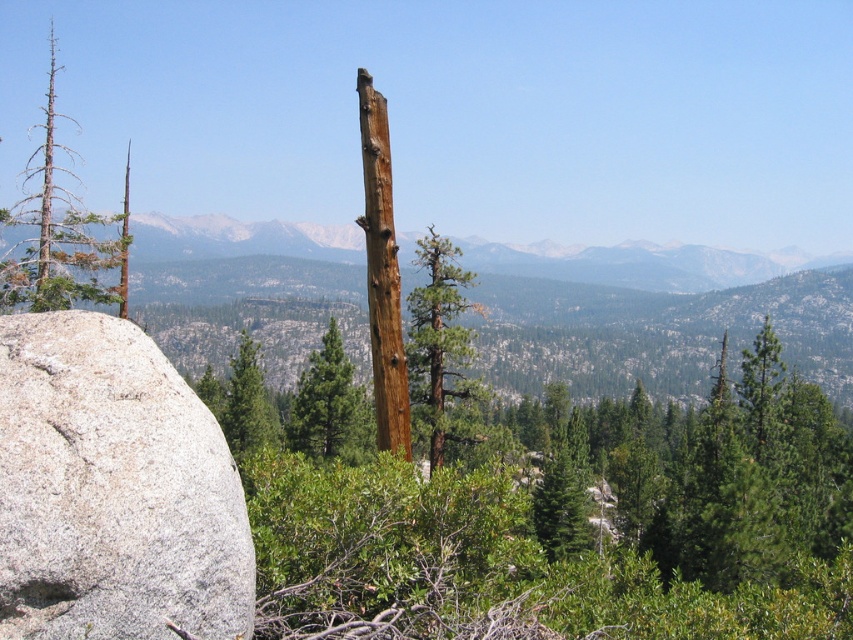
You are a hiker planning to take a photo of the gray rough boulder at left from the center of the image. Based on its coordinates, in which direction should you move to get a better view?

The gray rough boulder at left is located at point (112, 490), so you should move to the right and slightly downward to center it in your viewfinder.

From the picture: You are a hiker who wants to take a photo of the gray rough boulder at left and the green rough bark tree at center. Since you have a camera with a fixed focal length, you need to know which object is taller to adjust your settings. Can you tell me which one is taller?

The green rough bark tree at center is taller than the gray rough boulder at left.